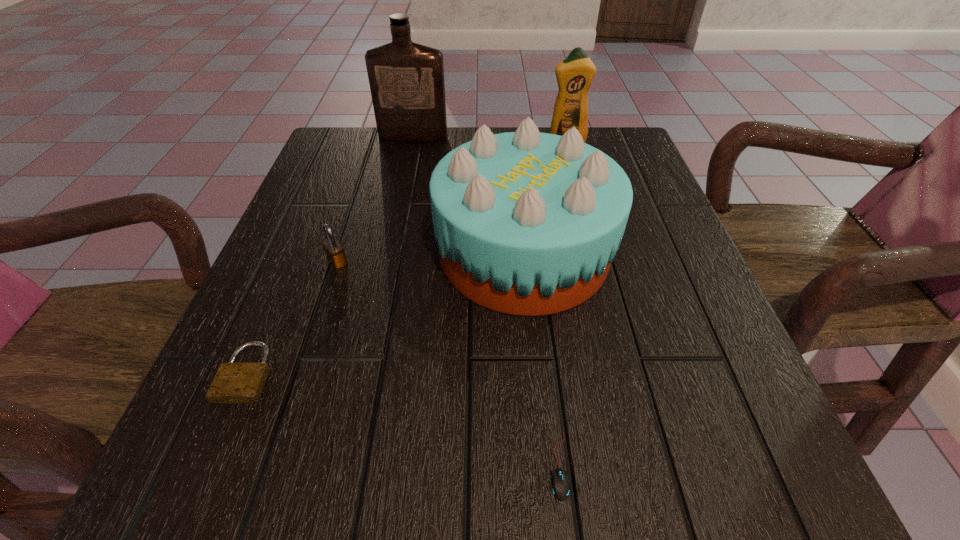
Locate an element on the screen. Image resolution: width=960 pixels, height=540 pixels. liquor is located at coordinates (406, 79).

In order to click on detergent in this screenshot , I will do `click(575, 73)`.

Identify the location of cake. Image resolution: width=960 pixels, height=540 pixels. (527, 223).

Locate an element on the screen. The width and height of the screenshot is (960, 540). the taller padlock is located at coordinates (334, 251).

Where is `the right padlock`? the right padlock is located at coordinates (334, 251).

This screenshot has width=960, height=540. I want to click on the leftmost object, so click(x=234, y=382).

The height and width of the screenshot is (540, 960). Identify the location of the fifth tallest object. (234, 382).

Locate an element on the screen. the shortest object is located at coordinates (559, 484).

At what (x,y) coordinates should I click in order to perform the action: click on the nearest object. Please return your answer as a coordinate pair (x, y). The image size is (960, 540). Looking at the image, I should click on (559, 484).

This screenshot has height=540, width=960. I want to click on vacant space located on the label side of the liquor, so click(409, 158).